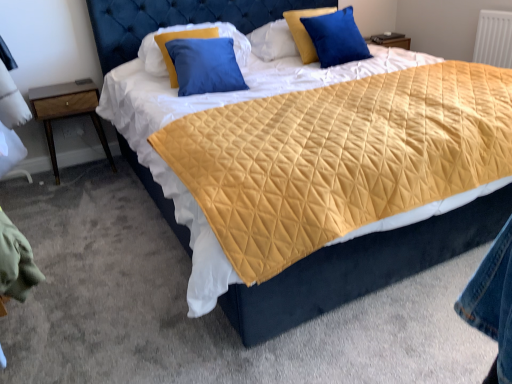
Question: Should I look upward or downward to see blue velvet pillow at upper center, the 3th pillow in the right-to-left sequence?

Choices:
 (A) down
 (B) up

Answer: (B)

Question: Considering the relative sizes of blue satin pillow at upper right, which ranks as the 1th pillow in right-to-left order, and blue velvet pillow at upper center, the 3th pillow in the right-to-left sequence, in the image provided, is blue satin pillow at upper right, which ranks as the 1th pillow in right-to-left order, thinner than blue velvet pillow at upper center, the 3th pillow in the right-to-left sequence,?

Choices:
 (A) no
 (B) yes

Answer: (B)

Question: Is blue satin pillow at upper right, which ranks as the 1th pillow in right-to-left order, located outside blue velvet pillow at upper center, arranged as the first pillow when viewed from the left?

Choices:
 (A) yes
 (B) no

Answer: (A)

Question: Is blue velvet pillow at upper center, the 3th pillow in the right-to-left sequence, completely or partially inside blue satin pillow at upper right, the third pillow positioned from the left?

Choices:
 (A) no
 (B) yes

Answer: (A)

Question: Is blue satin pillow at upper right, the third pillow positioned from the left, to the right of blue velvet pillow at upper center, arranged as the first pillow when viewed from the left, from the viewer's perspective?

Choices:
 (A) yes
 (B) no

Answer: (A)

Question: From a real-world perspective, is blue satin pillow at upper right, which ranks as the 1th pillow in right-to-left order, physically below blue velvet pillow at upper center, arranged as the first pillow when viewed from the left?

Choices:
 (A) yes
 (B) no

Answer: (A)

Question: Does blue satin pillow at upper right, the third pillow positioned from the left, appear on the left side of blue velvet pillow at upper center, arranged as the first pillow when viewed from the left?

Choices:
 (A) yes
 (B) no

Answer: (B)

Question: Is blue velvet pillow at upper center, arranged as the first pillow when viewed from the left, completely or partially outside of blue satin pillow at upper right, which ranks as the 1th pillow in right-to-left order?

Choices:
 (A) yes
 (B) no

Answer: (A)

Question: Does blue velvet pillow at upper center, the 3th pillow in the right-to-left sequence, have a smaller size compared to blue satin pillow at upper right, the third pillow positioned from the left?

Choices:
 (A) no
 (B) yes

Answer: (A)

Question: Is blue velvet pillow at upper center, arranged as the first pillow when viewed from the left, taller than blue satin pillow at upper right, the third pillow positioned from the left?

Choices:
 (A) no
 (B) yes

Answer: (B)

Question: Considering the relative sizes of blue velvet pillow at upper center, the 3th pillow in the right-to-left sequence, and blue satin pillow at upper right, the third pillow positioned from the left, in the image provided, is blue velvet pillow at upper center, the 3th pillow in the right-to-left sequence, shorter than blue satin pillow at upper right, the third pillow positioned from the left,?

Choices:
 (A) no
 (B) yes

Answer: (A)

Question: From the image's perspective, is blue velvet pillow at upper center, the 3th pillow in the right-to-left sequence, over blue satin pillow at upper right, which ranks as the 1th pillow in right-to-left order?

Choices:
 (A) no
 (B) yes

Answer: (A)

Question: Is blue velvet pillow at upper center, the 3th pillow in the right-to-left sequence, thinner than blue satin pillow at upper right, the third pillow positioned from the left?

Choices:
 (A) yes
 (B) no

Answer: (B)

Question: From a real-world perspective, is wooden nightstand at left under blue satin pillow at upper right, the third pillow positioned from the left?

Choices:
 (A) no
 (B) yes

Answer: (B)